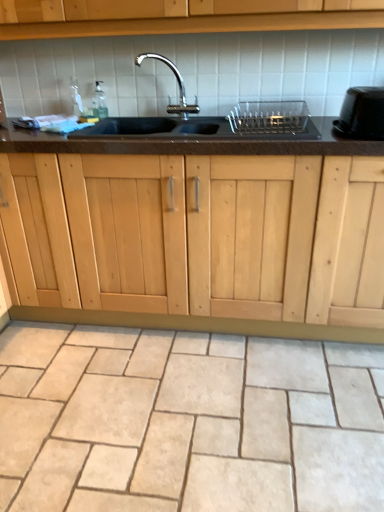
Question: Do you think black granite sink at center is within beige stone tile at lower center, or outside of it?

Choices:
 (A) inside
 (B) outside

Answer: (B)

Question: Does point (196, 138) appear closer or farther from the camera than point (1, 415)?

Choices:
 (A) closer
 (B) farther

Answer: (B)

Question: Which object is the farthest from the clear plastic dish rack at center, the first appliance positioned from the left?

Choices:
 (A) black glossy toaster at right, the 1th appliance viewed from the right
 (B) beige stone tile at lower center
 (C) black granite sink at center

Answer: (B)

Question: Estimate the real-world distances between objects in this image. Which object is farther from the clear plastic dish rack at center, the first appliance positioned from the left?

Choices:
 (A) beige stone tile at lower center
 (B) black granite sink at center
 (C) black glossy toaster at right, the second appliance positioned from the left

Answer: (A)